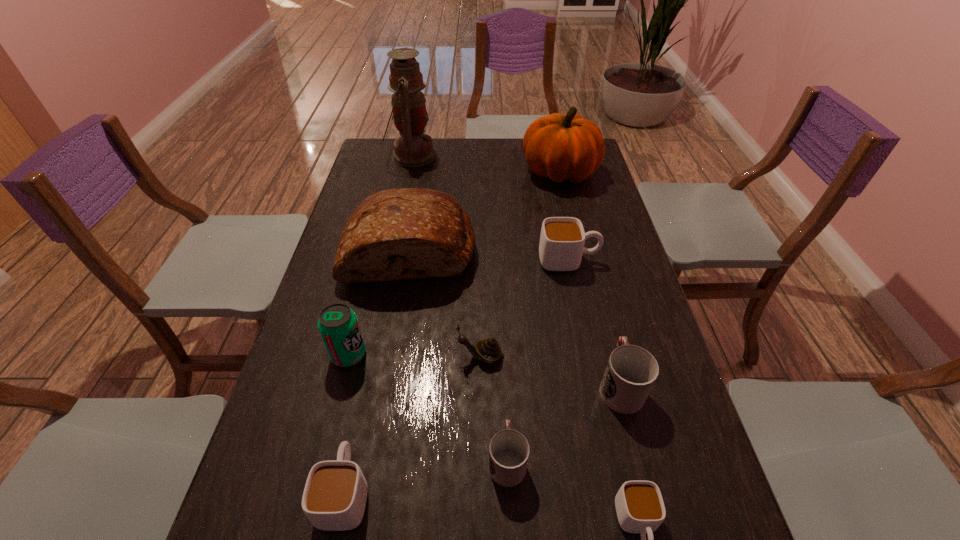
Locate an element on the screen. The image size is (960, 540). the tallest object is located at coordinates (413, 148).

Where is `oil lamp`? This screenshot has height=540, width=960. oil lamp is located at coordinates (413, 148).

The image size is (960, 540). I want to click on the ninth shortest object, so click(562, 147).

Locate an element on the screen. orange pumpkin is located at coordinates (562, 147).

You are a GUI agent. You are given a task and a screenshot of the screen. Output one action in this format:
    pyautogui.click(x=<x>, y=<y>)
    Task: Click on the third tallest object
    
    Given the screenshot: What is the action you would take?
    pyautogui.click(x=406, y=233)

Where is `pop soda`? This screenshot has height=540, width=960. pop soda is located at coordinates (338, 325).

The width and height of the screenshot is (960, 540). In order to click on the farthest cup in this screenshot , I will do `click(562, 239)`.

This screenshot has width=960, height=540. I want to click on the farthest white cup, so click(562, 239).

What are the coordinates of `the second farthest cup` in the screenshot? It's located at (631, 371).

Locate an element on the screen. The width and height of the screenshot is (960, 540). the right red cup is located at coordinates (631, 371).